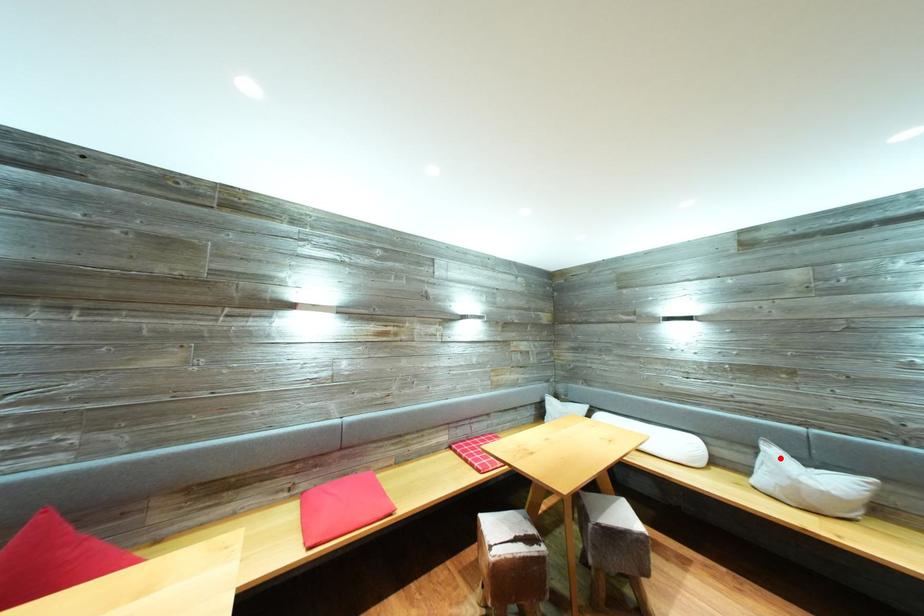
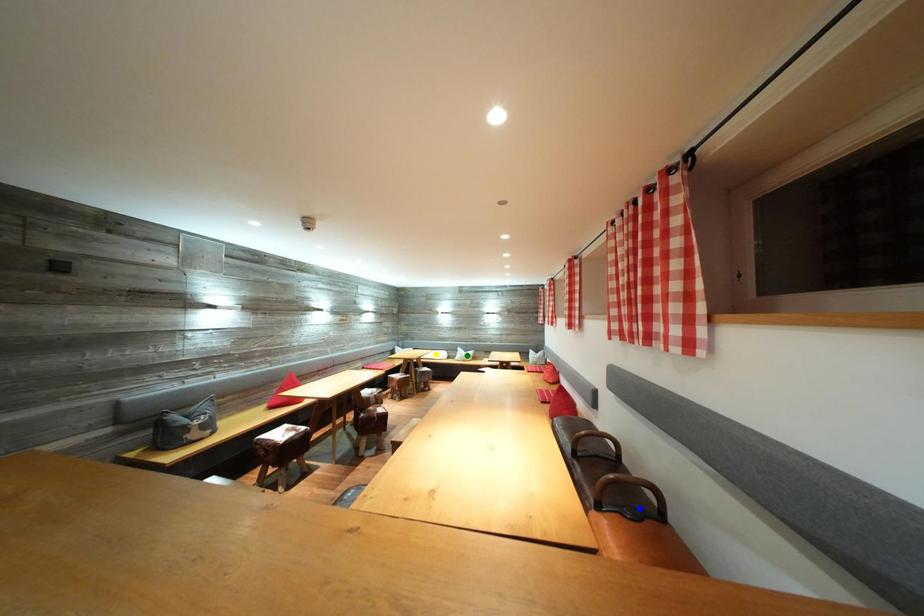
Question: I am providing you with two images of the same scene from different viewpoints. A red point is marked on the first image. You are given multiple points on the second image. Which point in image 2 is actually the same real-world point as the red point in image 1?

Choices:
 (A) green point
 (B) blue point
 (C) yellow point

Answer: (A)